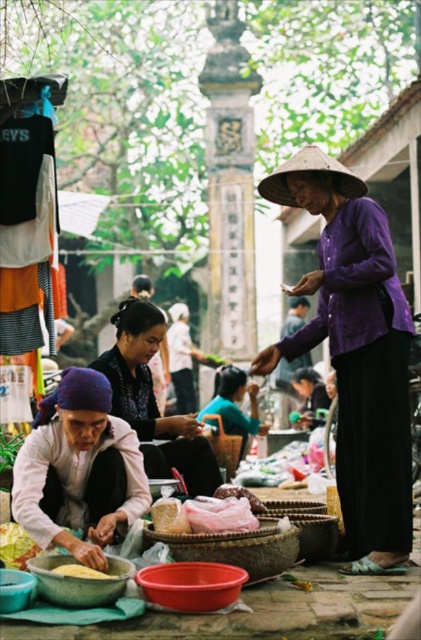
You are standing at the origin point of the image. Which object is located at the coordinates point (356, 353)?

The purple matte hat at upper right is located at point (356, 353).

You are a customer at the market and want to buy a scarf and a blouse. The vendor has a white fabric headscarf at center and a matte purple blouse at center. If you need to reach both items quickly, which one is closer to your current position?

The white fabric headscarf at center and matte purple blouse at center are both at the center, so they are equally close to your position.

In the market scene, there is a purple matte hat at upper right and a yellow matte corn at lower center. From the perspective of an observer looking at the image, which object is positioned more to the right?

The purple matte hat at upper right is positioned more to the right than the yellow matte corn at lower center.